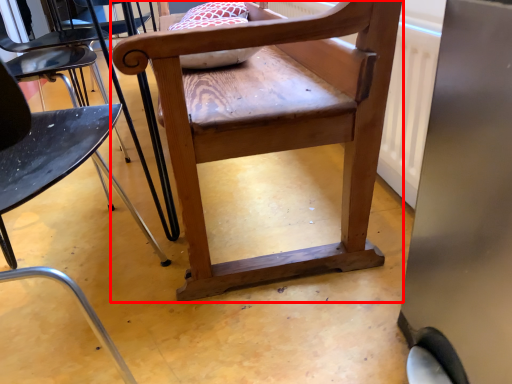
Question: From the image's perspective, where is chair (annotated by the red box) located in relation to chair in the image?

Choices:
 (A) above
 (B) below

Answer: (A)